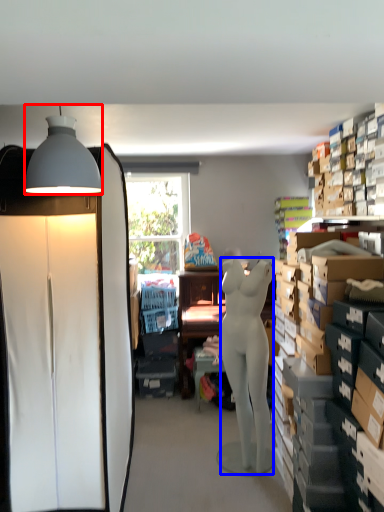
Question: Which point is further to the camera, lamp (highlighted by a red box) or person (highlighted by a blue box)?

Choices:
 (A) lamp
 (B) person

Answer: (B)